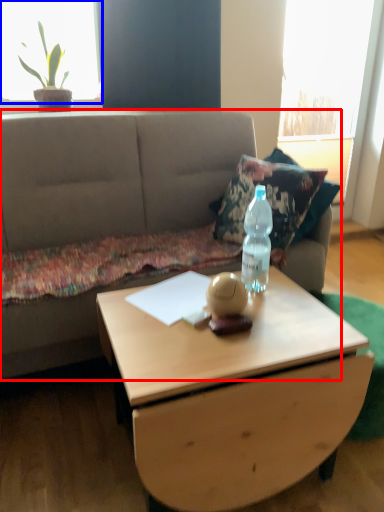
Question: Which of the following is the closest to the observer, studio couch (highlighted by a red box) or window screen (highlighted by a blue box)?

Choices:
 (A) studio couch
 (B) window screen

Answer: (A)